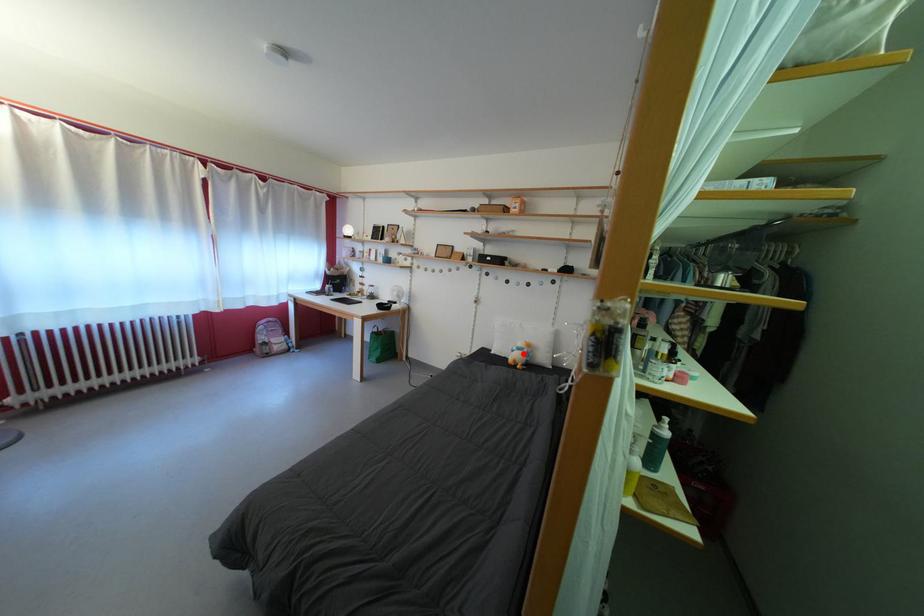
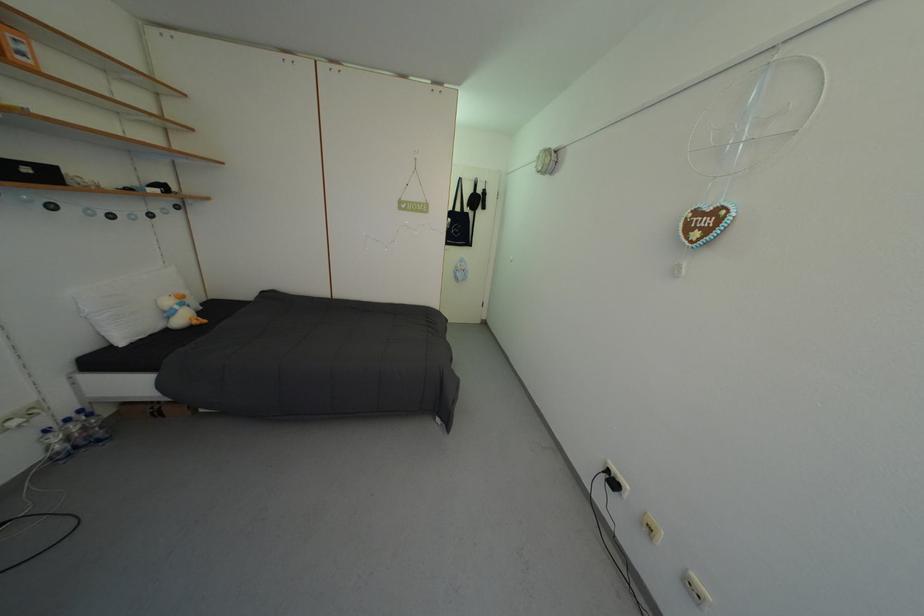
Question: I am providing you with two images of the same scene from different viewpoints. A red point is shown in image1. For the corresponding object point in image2, is it positioned nearer or farther from the camera?

Choices:
 (A) Nearer
 (B) Farther

Answer: (A)